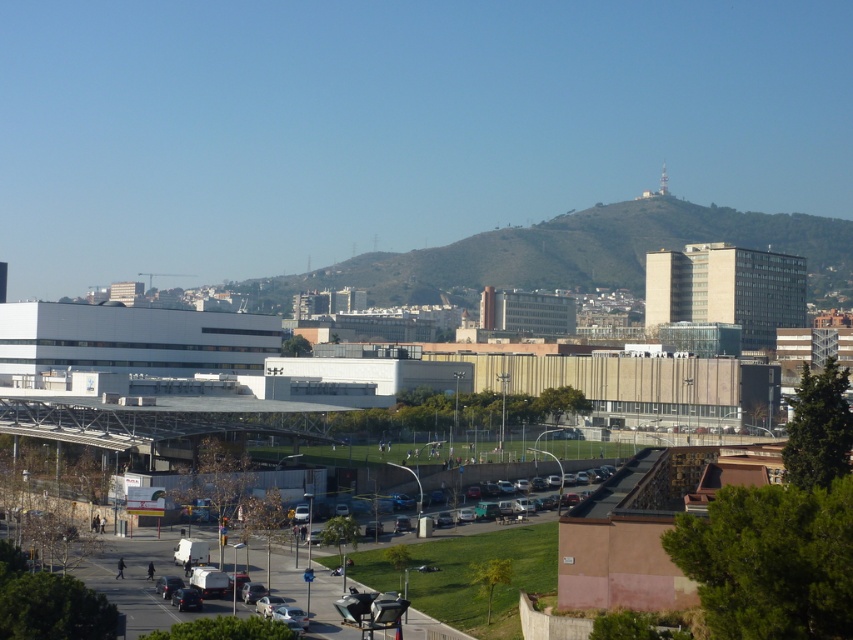
Question: Is silver metallic car at lower center thinner than metallic silver van at lower center?

Choices:
 (A) yes
 (B) no

Answer: (B)

Question: Which point is farther from the camera taking this photo?

Choices:
 (A) (198, 600)
 (B) (277, 614)

Answer: (A)

Question: Is silver metallic car at lower center above metallic silver van at lower center?

Choices:
 (A) no
 (B) yes

Answer: (A)

Question: Can you confirm if silver metallic car at lower center is positioned to the left of metallic silver van at lower center?

Choices:
 (A) yes
 (B) no

Answer: (B)

Question: Which point is farther to the camera?

Choices:
 (A) (195, 605)
 (B) (273, 620)

Answer: (A)